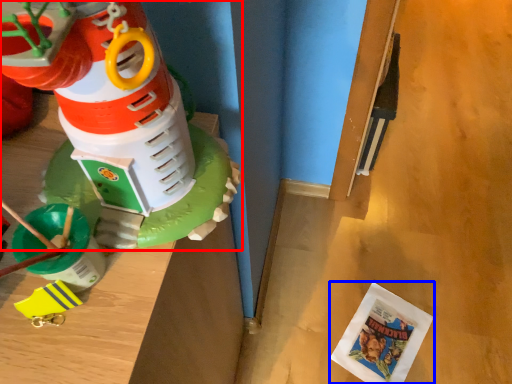
Question: Among these objects, which one is farthest to the camera, toy (highlighted by a red box) or comic book (highlighted by a blue box)?

Choices:
 (A) toy
 (B) comic book

Answer: (B)